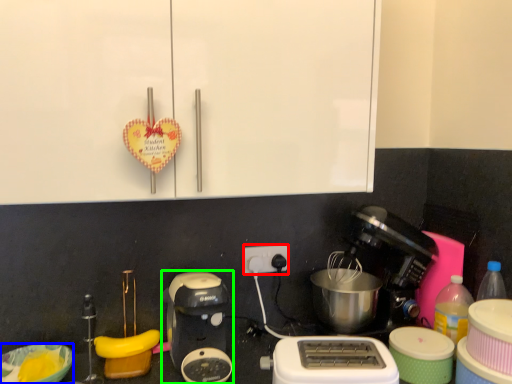
Question: Which is nearer to the power plugs and sockets (highlighted by a red box)? bowl (highlighted by a blue box) or coffee maker (highlighted by a green box).

Choices:
 (A) bowl
 (B) coffee maker

Answer: (B)